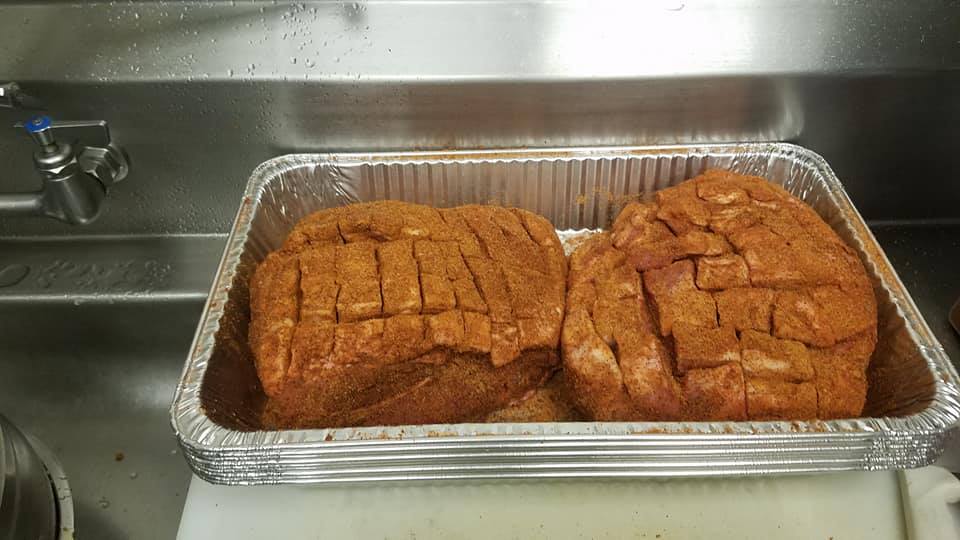
This screenshot has height=540, width=960. I want to click on large stainless steel sink, so click(x=542, y=40), click(x=170, y=186), click(x=886, y=135), click(x=98, y=399), click(x=136, y=509), click(x=932, y=288).